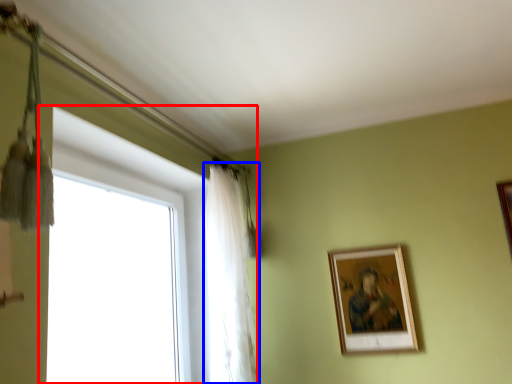
Question: Which object appears closest to the camera in this image, window (highlighted by a red box) or curtain (highlighted by a blue box)?

Choices:
 (A) window
 (B) curtain

Answer: (A)